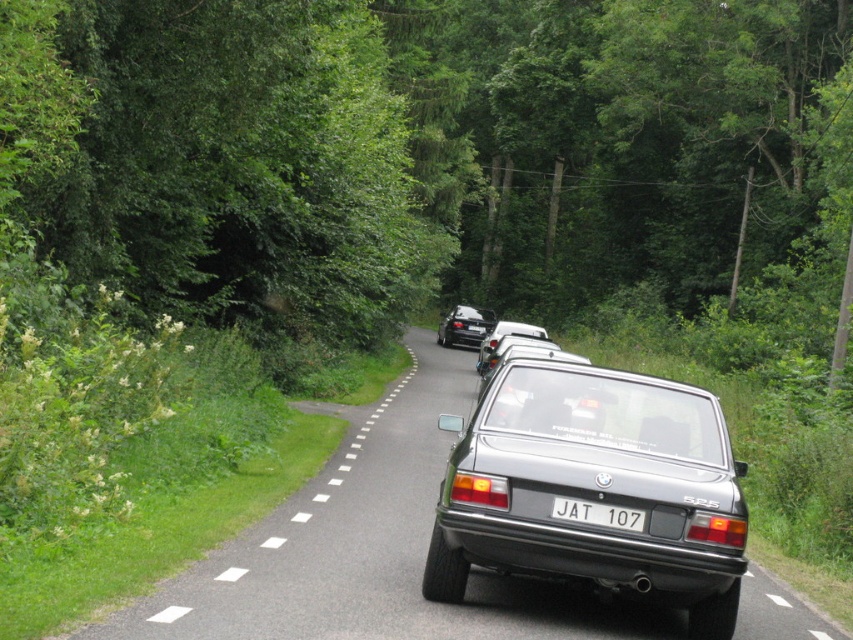
You are a driver approaching the satin silver sedan at center and the white plastic line at center on this narrow road. Which object would appear closer to you when looking straight ahead?

The satin silver sedan at center is much taller than the white plastic line at center, so it would appear closer to you when looking straight ahead.

You are a driver navigating a narrow forest road and see the point marked at coordinates [596,513]. What object does this point indicate?

The point at coordinates [596,513] indicates the white plastic license plate at center.

You are standing at the point closer to the camera in the image. Which point are you standing at, point [393,202] or point [634,516]?

You are standing at point [634,516] because it is closer to the camera than point [393,202].